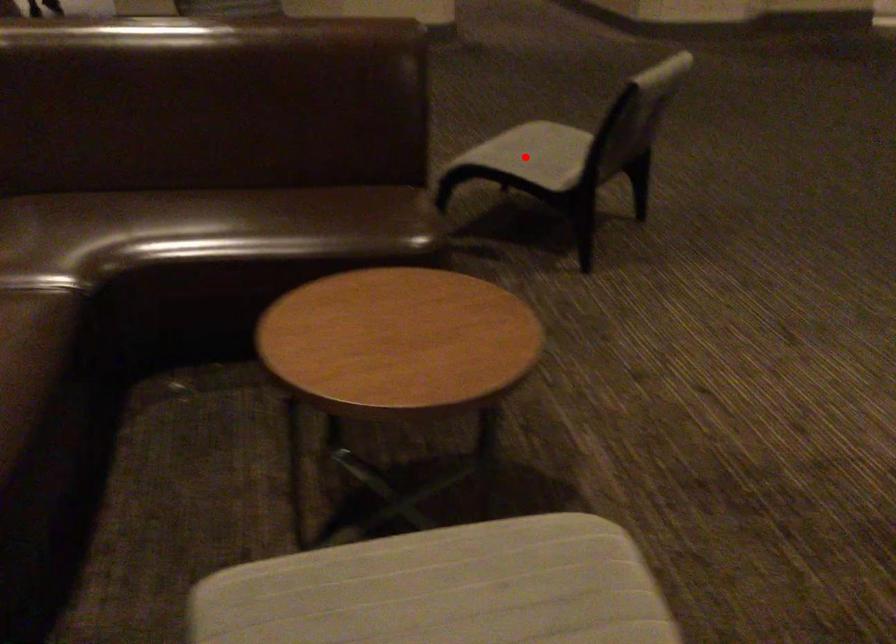
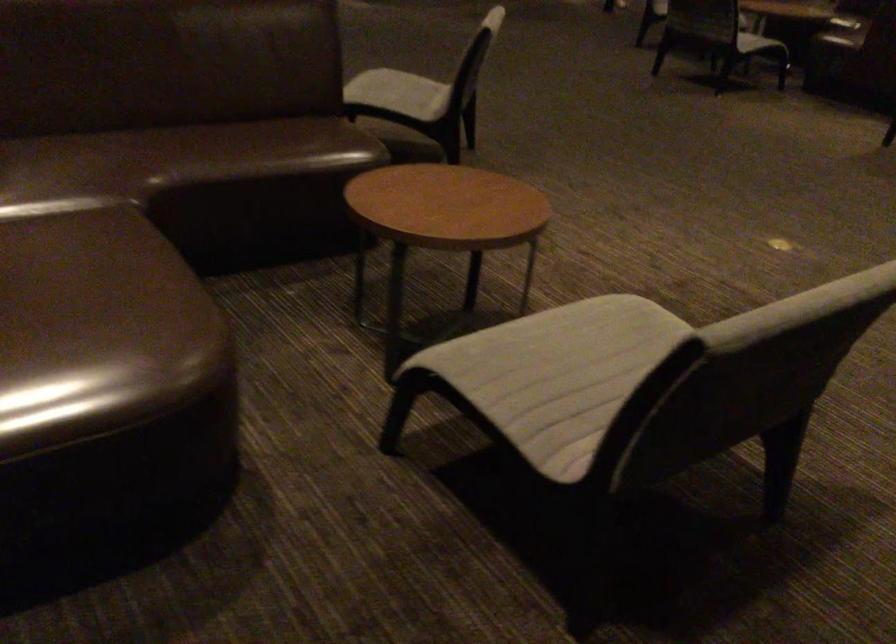
Question: I am providing you with two images of the same scene from different viewpoints. In image1, a red point is highlighted. Considering the same 3D point in image2, which of the following is correct?

Choices:
 (A) It is closer
 (B) It is farther

Answer: (B)